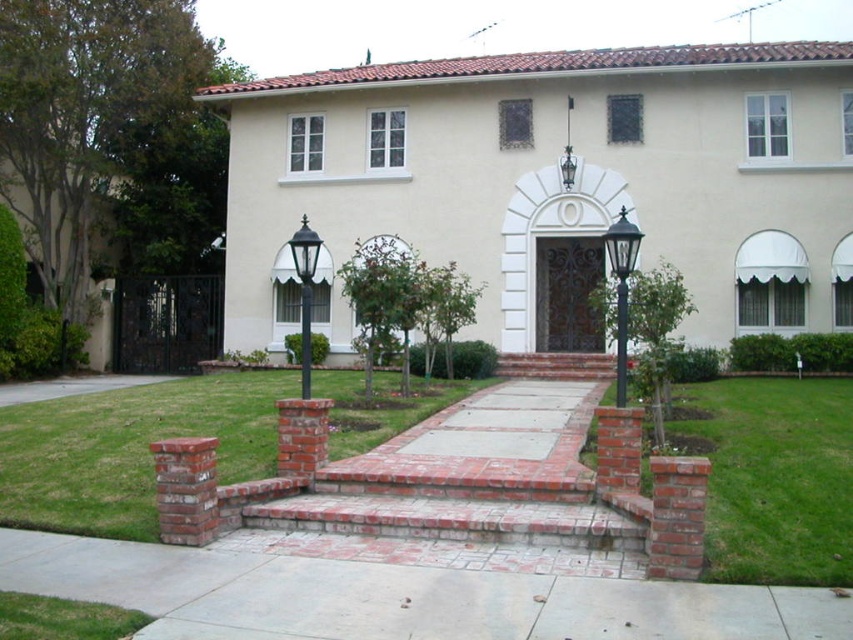
Question: Where is concrete at center located in relation to green grass at center in the image?

Choices:
 (A) above
 (B) below

Answer: (B)

Question: Can you confirm if concrete at center is wider than green grass at lower right?

Choices:
 (A) yes
 (B) no

Answer: (B)

Question: Among these points, which one is farthest from the camera?

Choices:
 (A) (194, 400)
 (B) (297, 634)

Answer: (A)

Question: Which of the following is the closest to the observer?

Choices:
 (A) (838, 499)
 (B) (654, 605)

Answer: (B)

Question: Considering the real-world distances, which object is closest to the green grass at lower right?

Choices:
 (A) green grass at center
 (B) concrete at center

Answer: (A)

Question: Is green grass at center positioned at the back of green grass at lower right?

Choices:
 (A) yes
 (B) no

Answer: (A)